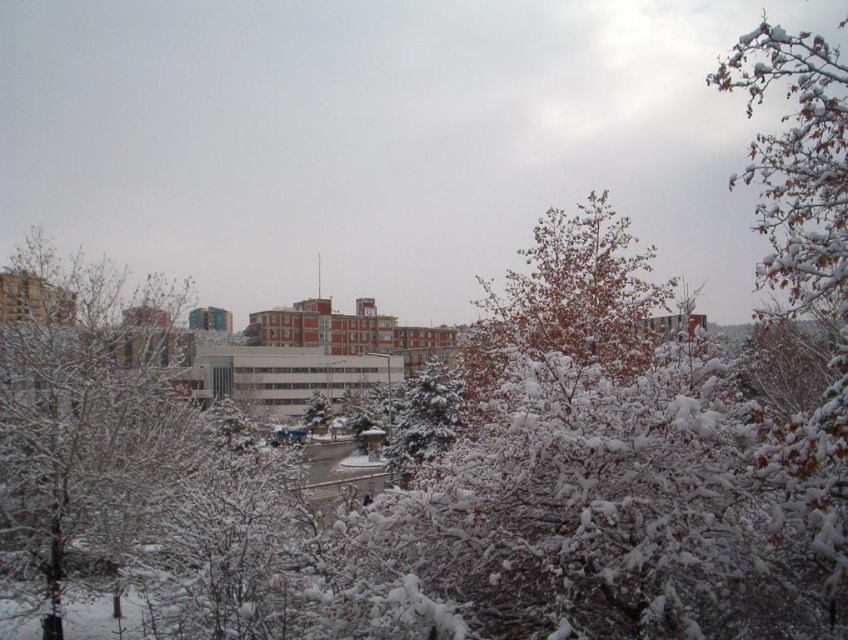
Question: Is snow-covered branches at upper right to the right of green matte tree at center from the viewer's perspective?

Choices:
 (A) no
 (B) yes

Answer: (B)

Question: Which object is closer to the camera taking this photo?

Choices:
 (A) green matte tree at center
 (B) snow-covered branches at upper right

Answer: (B)

Question: Considering the relative positions of snow-covered branches at upper right and green matte tree at center in the image provided, where is snow-covered branches at upper right located with respect to green matte tree at center?

Choices:
 (A) left
 (B) right

Answer: (B)

Question: Can you confirm if snow-covered branches at upper right is positioned to the left of green matte tree at center?

Choices:
 (A) yes
 (B) no

Answer: (B)

Question: Which point is closer to the camera?

Choices:
 (A) pos(784,168)
 (B) pos(328,412)

Answer: (A)